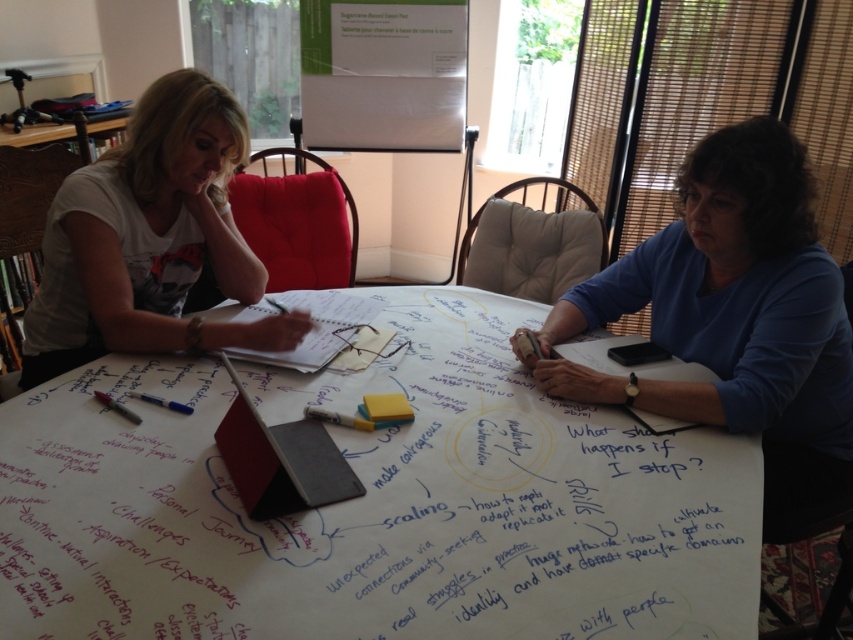
Question: Is blue fabric shirt at right smaller than white matte pen at center?

Choices:
 (A) no
 (B) yes

Answer: (A)

Question: Can you confirm if blue fabric shirt at right is thinner than matte white t-shirt at upper left?

Choices:
 (A) yes
 (B) no

Answer: (B)

Question: Which of these objects is positioned closest to the white matte pen at center?

Choices:
 (A) blue matte pen at center
 (B) blue fabric shirt at right

Answer: (A)

Question: Is the position of white paperboard at center more distant than that of blue matte pen at center?

Choices:
 (A) yes
 (B) no

Answer: (B)

Question: Estimate the real-world distances between objects in this image. Which object is closer to the white matte pen at center?

Choices:
 (A) yellow matte sticky note at center
 (B) blue matte pen at center
 (C) matte white t-shirt at upper left
 (D) blue fabric shirt at right

Answer: (A)

Question: Which point is closer to the camera taking this photo?

Choices:
 (A) (177, 412)
 (B) (334, 413)
 (C) (409, 419)
 (D) (778, 474)

Answer: (B)